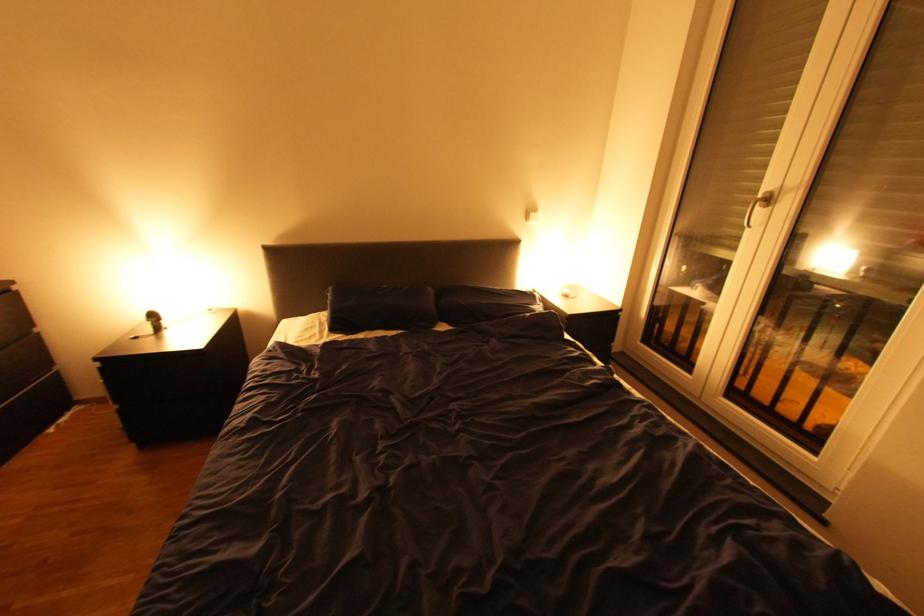
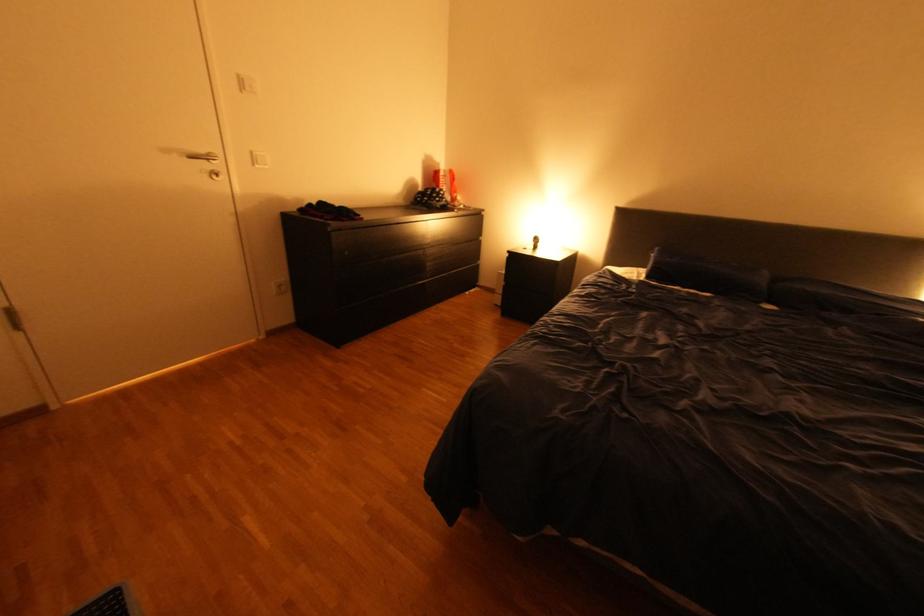
Question: The camera is either moving clockwise (left) or counter-clockwise (right) around the object. The first image is from the beginning of the video and the second image is from the end. Is the camera moving left or right when shooting the video?

Choices:
 (A) Left
 (B) Right

Answer: (B)